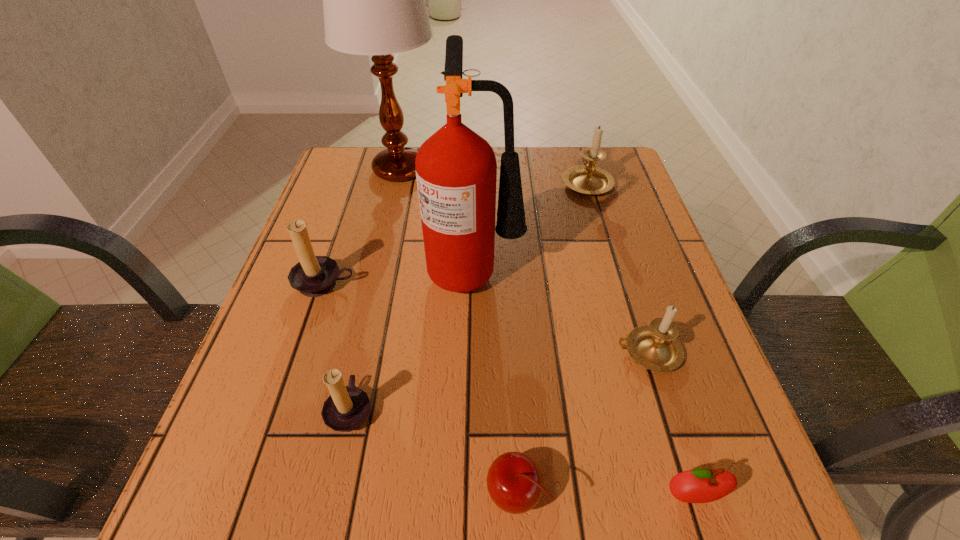
I want to click on free space located on the left of the cherry, so click(347, 493).

Find the location of a particular element. table lamp positioned at the far edge is located at coordinates (374, 4).

The width and height of the screenshot is (960, 540). What are the coordinates of `candle holder present at the far edge` in the screenshot? It's located at (588, 179).

Identify the location of apple that is at the near edge. The height and width of the screenshot is (540, 960). (701, 485).

Identify the location of cherry situated at the near edge. (515, 483).

Where is `table lamp situated at the left edge`? This screenshot has height=540, width=960. table lamp situated at the left edge is located at coordinates (374, 4).

The width and height of the screenshot is (960, 540). I want to click on apple present at the right edge, so click(x=701, y=485).

Image resolution: width=960 pixels, height=540 pixels. Identify the location of object present at the far left corner. [374, 4].

Find the location of a particular element. Image resolution: width=960 pixels, height=540 pixels. object that is positioned at the far right corner is located at coordinates tap(588, 179).

Where is `object that is at the near right corner`? object that is at the near right corner is located at coordinates (701, 485).